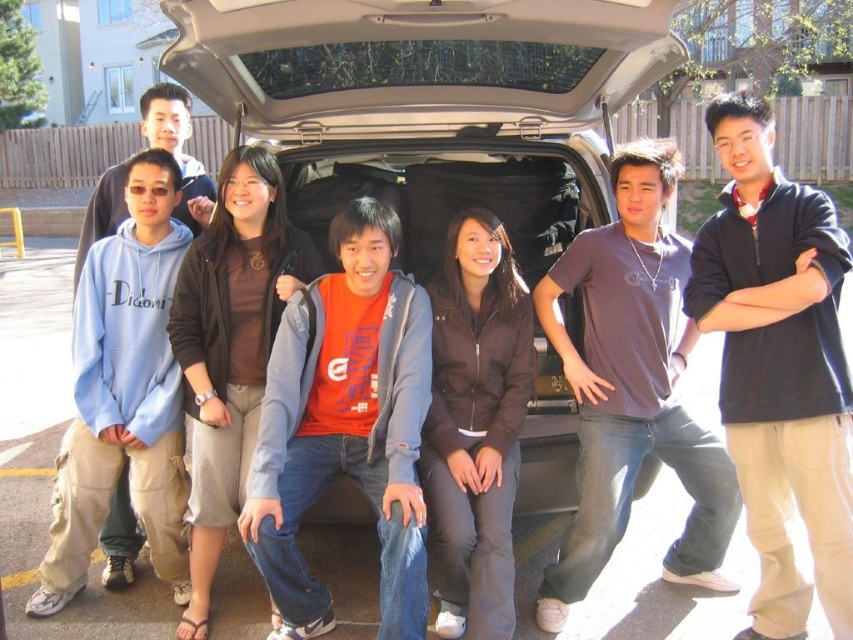
Who is positioned more to the right, black fabric minivan at center or matte orange t-shirt at center?

From the viewer's perspective, black fabric minivan at center appears more on the right side.

Is point (335, 6) positioned in front of point (398, 509)?

Yes, it is.

Between point (486, 180) and point (375, 481), which one is positioned in front?

Point (375, 481) is more forward.

You are a GUI agent. You are given a task and a screenshot of the screen. Output one action in this format:
    pyautogui.click(x=<x>, y=<y>)
    Task: Click on the black fabric minivan at center
    The image size is (853, 640).
    Given the screenshot: What is the action you would take?
    pyautogui.click(x=430, y=104)

Describe the element at coordinates (779, 365) in the screenshot. I see `dark blue zip-up sweater at center` at that location.

Locate an element on the screen. Image resolution: width=853 pixels, height=640 pixels. dark blue zip-up sweater at center is located at coordinates (779, 365).

Between dark brown jacket at center and brown matte jacket at center, which one has less height?

With less height is dark brown jacket at center.

The width and height of the screenshot is (853, 640). What do you see at coordinates (476, 426) in the screenshot?
I see `dark brown jacket at center` at bounding box center [476, 426].

Locate an element on the screen. This screenshot has width=853, height=640. dark brown jacket at center is located at coordinates (476, 426).